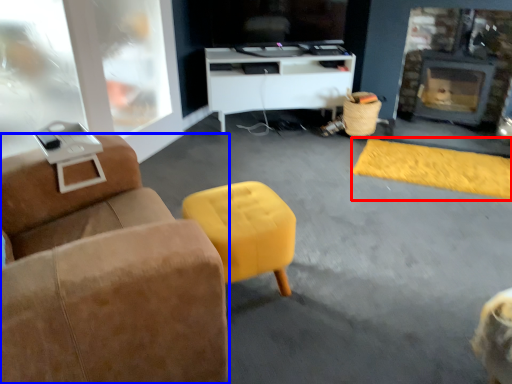
Question: Which object appears closest to the camera in this image, flat (highlighted by a red box) or furniture (highlighted by a blue box)?

Choices:
 (A) flat
 (B) furniture

Answer: (B)